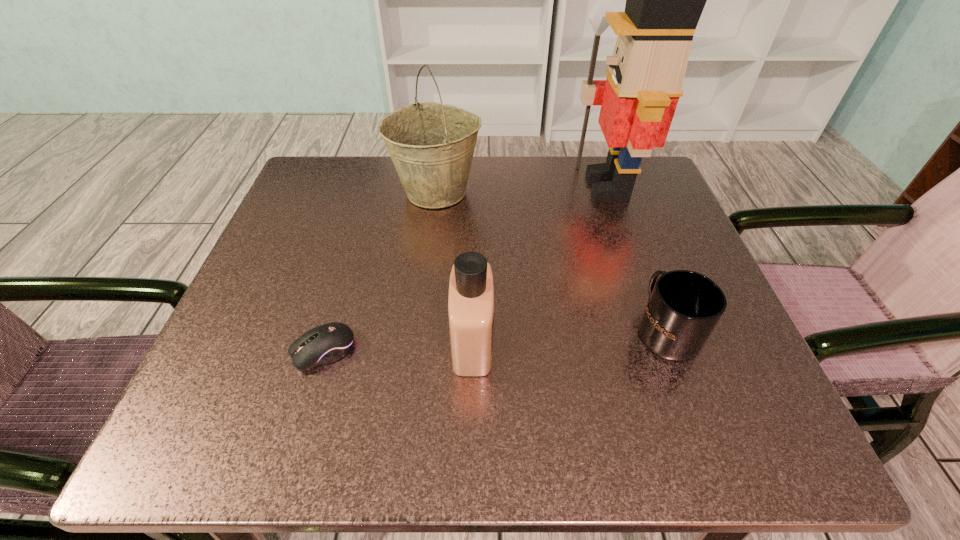
Locate an element on the screen. The width and height of the screenshot is (960, 540). free space that is in between the fourth shortest object and the shortest object is located at coordinates (379, 271).

Where is `vacant space that is in between the fourth tallest object and the computer mouse`? Image resolution: width=960 pixels, height=540 pixels. vacant space that is in between the fourth tallest object and the computer mouse is located at coordinates (494, 340).

Find the location of a particular element. The height and width of the screenshot is (540, 960). blank region between the fourth tallest object and the perfume is located at coordinates (569, 336).

The image size is (960, 540). Find the location of `vacant space that is in between the tallest object and the second tallest object`. vacant space that is in between the tallest object and the second tallest object is located at coordinates (521, 189).

Identify which object is located as the nearest to the computer mouse. Please provide its 2D coordinates. Your answer should be formatted as a tuple, i.e. [(x, y)], where the tuple contains the x and y coordinates of a point satisfying the conditions above.

[(471, 292)]

Identify which object is located as the third nearest to the perfume. Please provide its 2D coordinates. Your answer should be formatted as a tuple, i.e. [(x, y)], where the tuple contains the x and y coordinates of a point satisfying the conditions above.

[(431, 144)]

I want to click on vacant space that satisfies the following two spatial constraints: 1. in front of the tallest object holding the staff; 2. with the handle on the side of the fourth tallest object, so click(657, 329).

Where is `free point that satisfies the following two spatial constraints: 1. in front of the nutcracker holding the staff; 2. with the handle on the side of the mug`? This screenshot has width=960, height=540. free point that satisfies the following two spatial constraints: 1. in front of the nutcracker holding the staff; 2. with the handle on the side of the mug is located at coordinates (657, 329).